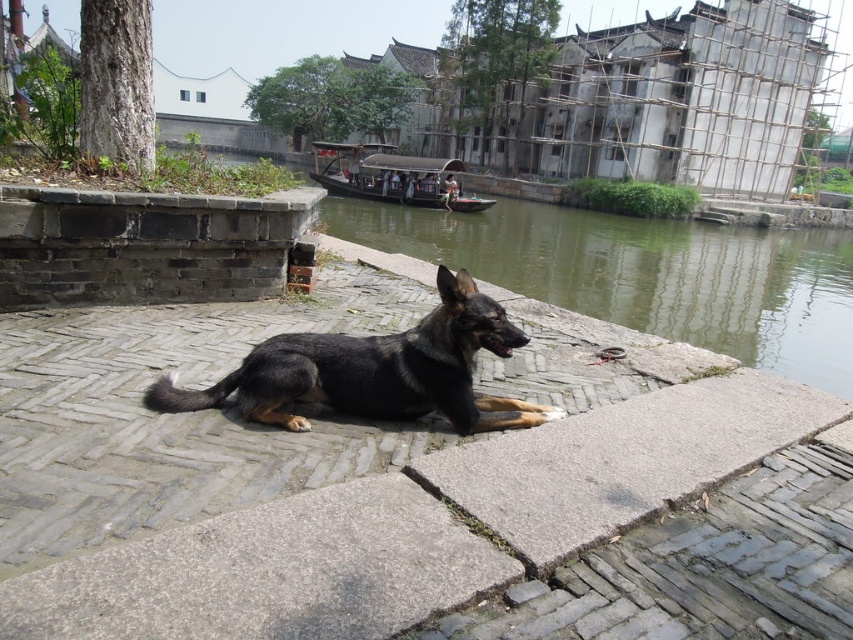
You are standing at the camera position and want to throw a stick to the German Shepherd dog. You have two options for where to throw it, either to point A at coordinates point (498, 522) or point B at coordinates point (747, 326). Which point is closer to you?

Point A at coordinates point (498, 522) is closer to the camera than point B at coordinates point (747, 326), so you should throw the stick to point A because it is nearer to your position.

Consider the image. You are a small robot with a width of 12 inches. You need to move from the gray brick pavement at center to the shiny black fur at center. Can you pass through the space between them without any obstacles?

The gray brick pavement at center and shiny black fur at center are 22.47 inches apart from each other. Since your width is 12 inches, which is less than the distance between them, you can pass through the space between them without any obstacles.

You are standing at the edge of the riverbank and want to reach the gray brick pavement at center. Based on the scene description, can you determine the direction you should walk to reach it?

The gray brick pavement at center is located at point (409, 488), which means it is positioned towards the lower right of the scene. Therefore, you should walk towards the lower right direction to reach it.